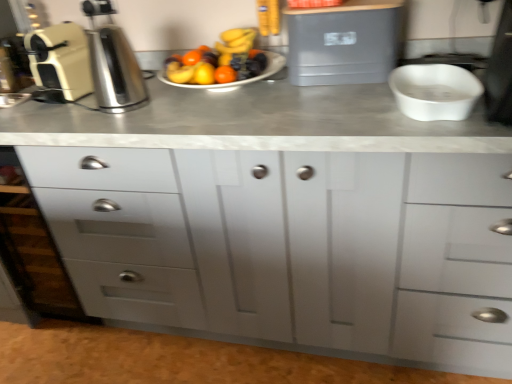
Locate an element on the screen. This screenshot has width=512, height=384. vacant space that is to the left of satin silver coffee machine at left is located at coordinates (55, 118).